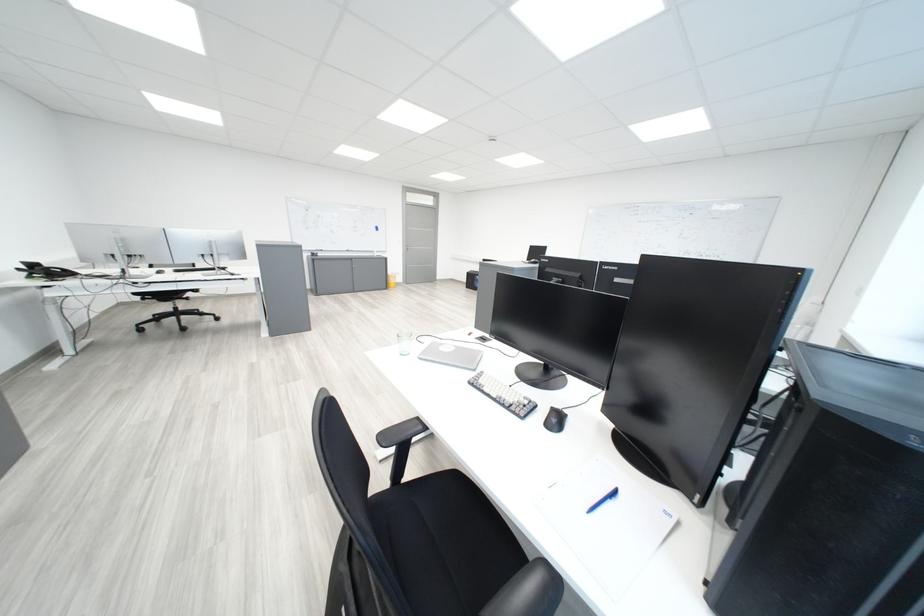
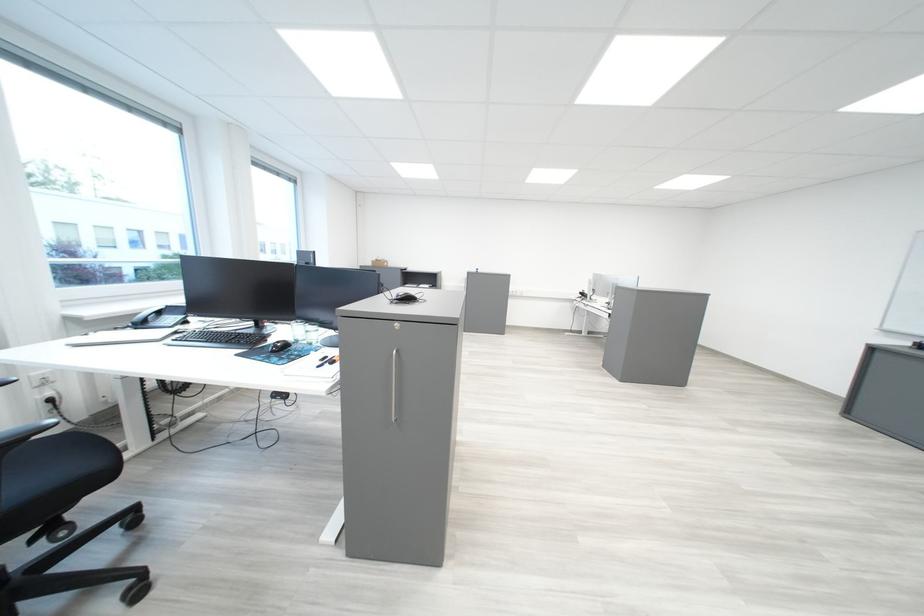
Question: I am providing you with two images of the same scene from different viewpoints. Which of the following objects are not visible in image2?

Choices:
 (A) black folding stand
 (B) black computer mouse
 (C) chair sitting surface
 (D) telephone handset

Answer: (D)